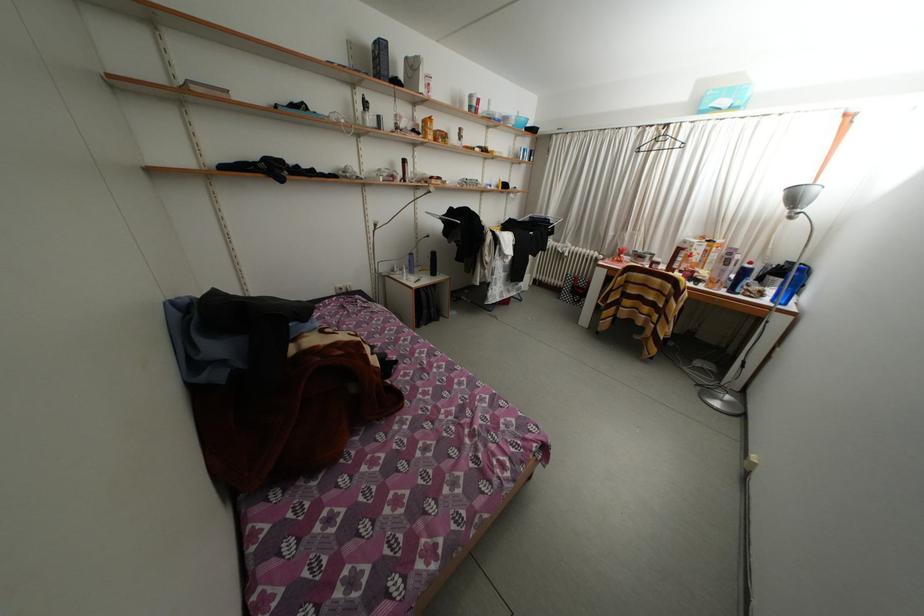
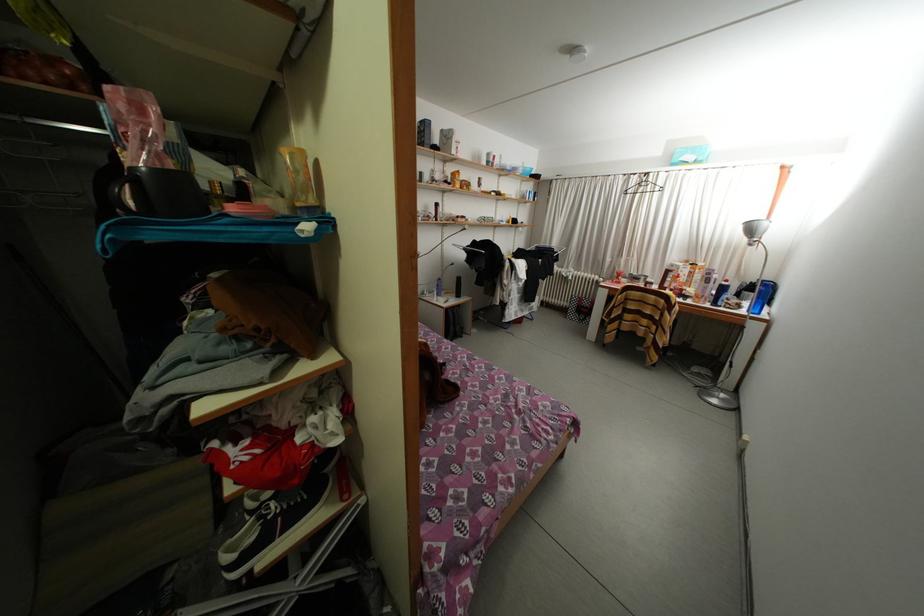
In the second image, find the point that corresponds to pixel 651 137 in the first image.

(638, 184)